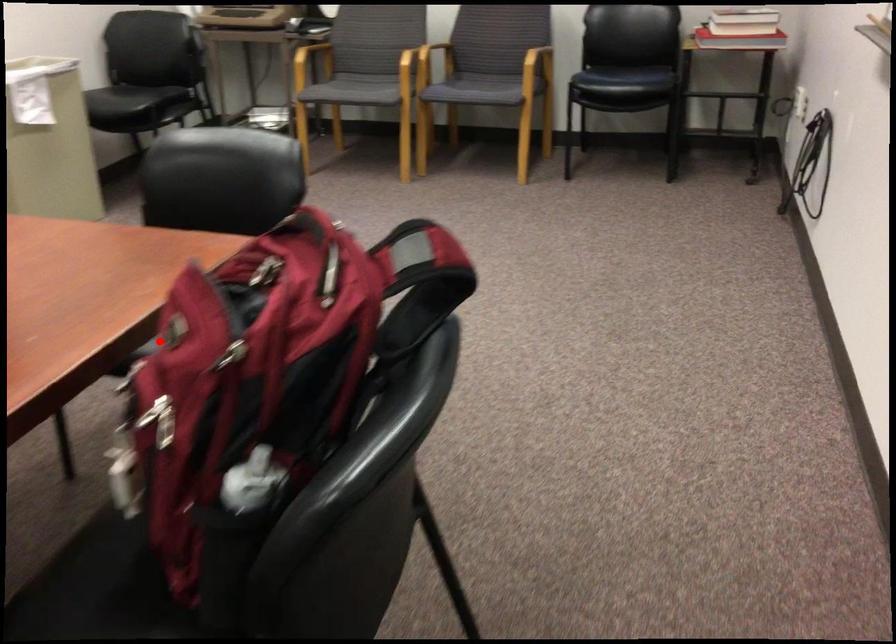
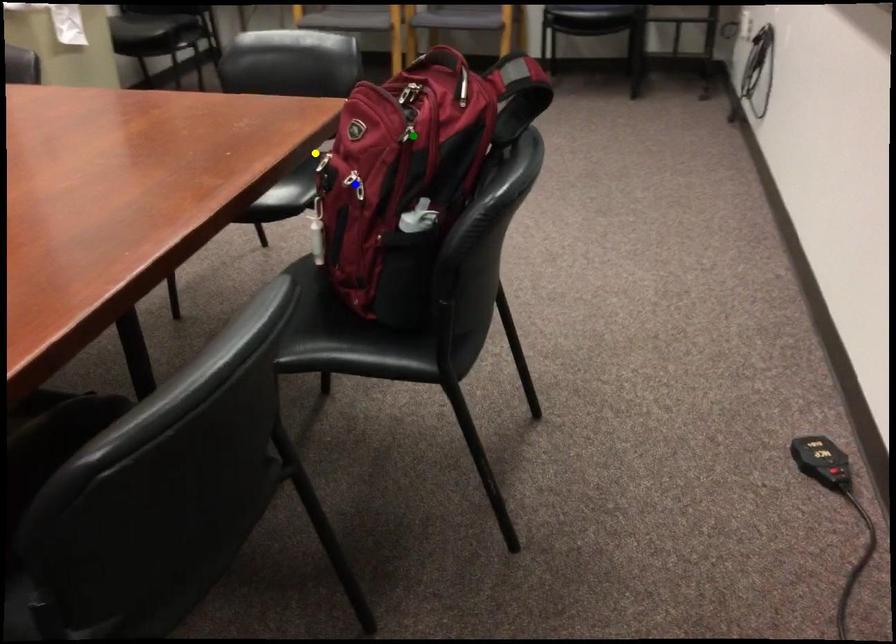
Question: I am providing you with two images of the same scene from different viewpoints. A red point is marked on the first image. You are given multiple points on the second image. Which point in image 2 represents the same 3d spot as the red point in image 1?

Choices:
 (A) yellow point
 (B) green point
 (C) blue point

Answer: (A)